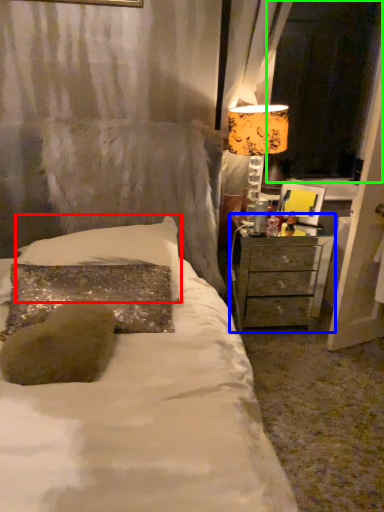
Question: Based on their relative distances, which object is nearer to pillow (highlighted by a red box)? Choose from nightstand (highlighted by a blue box) and window screen (highlighted by a green box).

Choices:
 (A) nightstand
 (B) window screen

Answer: (A)